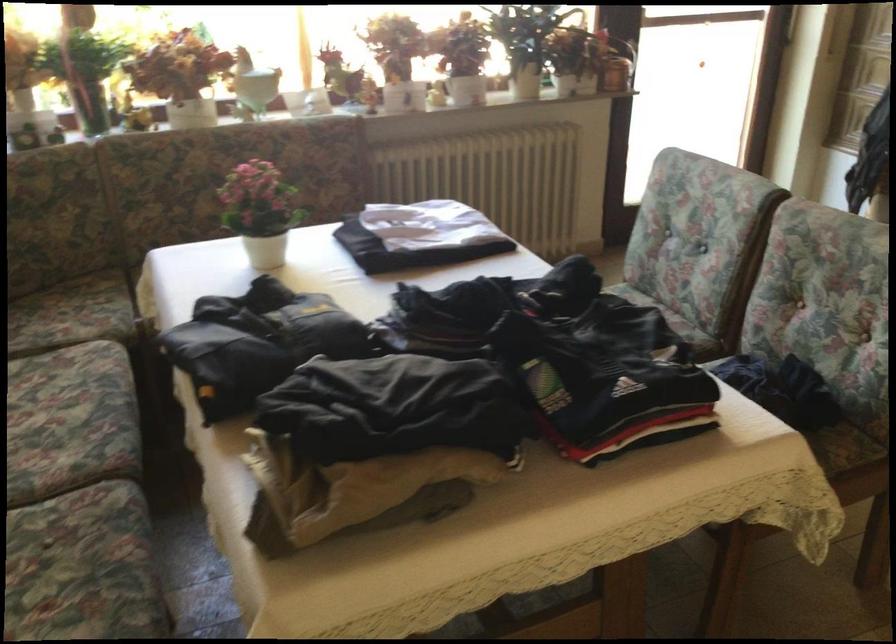
Describe the element at coordinates (252, 84) in the screenshot. I see `a ceramic figurine` at that location.